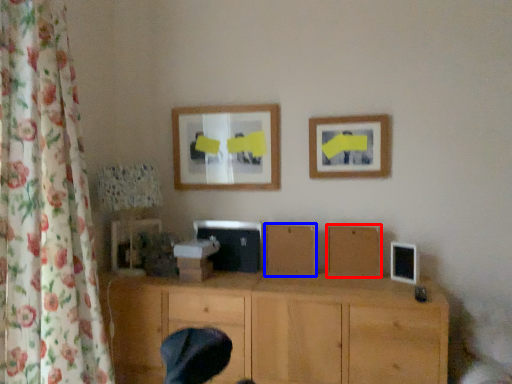
Question: Which object is closer to the camera taking this photo, wood (highlighted by a red box) or wood (highlighted by a blue box)?

Choices:
 (A) wood
 (B) wood

Answer: (A)